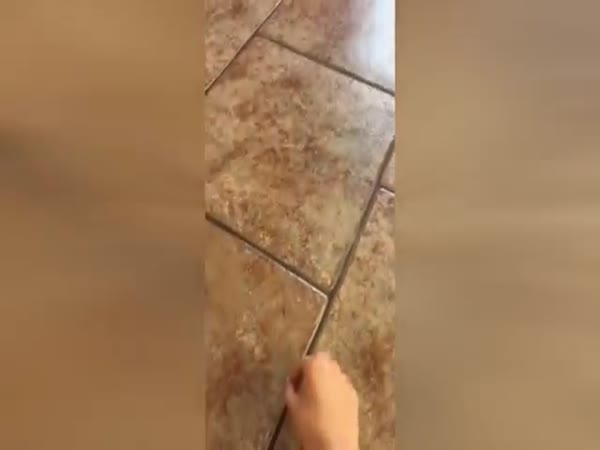
Locate an element on the screen. The width and height of the screenshot is (600, 450). brown floor is located at coordinates (287, 230), (279, 308), (234, 32), (339, 45), (373, 283), (387, 176).